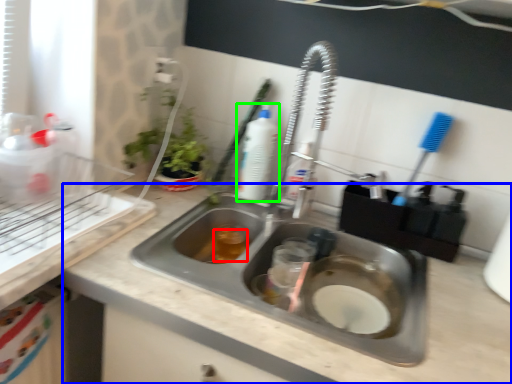
Question: Which is farther away from liquid (highlighted by a red box)? counter top (highlighted by a blue box) or cleaning product (highlighted by a green box)?

Choices:
 (A) counter top
 (B) cleaning product

Answer: (A)